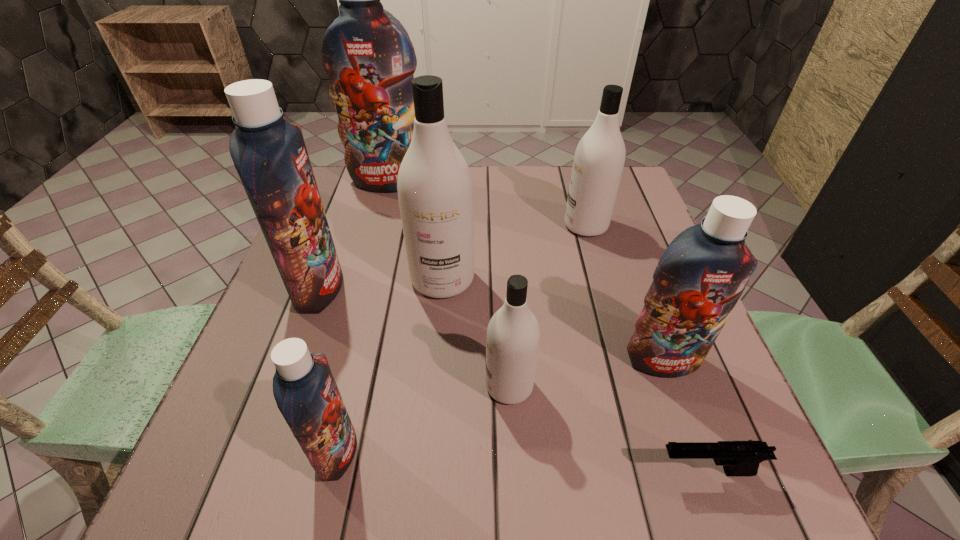
Locate an element on the screen. This screenshot has width=960, height=540. blue shampoo object that ranks as the closest to the leftmost white shampoo is located at coordinates (269, 154).

Identify which blue shampoo is located as the nearest to the pistol. Please provide its 2D coordinates. Your answer should be formatted as a tuple, i.e. [(x, y)], where the tuple contains the x and y coordinates of a point satisfying the conditions above.

[(700, 277)]

At what (x,y) coordinates should I click in order to perform the action: click on white shampoo that is the second closest one to the rightmost white shampoo. Please return your answer as a coordinate pair (x, y). The width and height of the screenshot is (960, 540). Looking at the image, I should click on (513, 334).

The height and width of the screenshot is (540, 960). I want to click on white shampoo that stands as the second closest to the third shampoo from right to left, so click(599, 158).

Identify the location of vacant space that satisfies the following two spatial constraints: 1. on the front label of the rightmost blue shampoo; 2. on the front label of the smallest blue shampoo. (696, 451).

The image size is (960, 540). Identify the location of blank area in the image that satisfies the following two spatial constraints: 1. on the front-facing side of the second nearest white shampoo; 2. on the front label of the nearest blue shampoo. (427, 451).

Where is `free space that satisfies the following two spatial constraints: 1. on the front label of the farthest object; 2. on the front label of the second farthest blue shampoo`? This screenshot has height=540, width=960. free space that satisfies the following two spatial constraints: 1. on the front label of the farthest object; 2. on the front label of the second farthest blue shampoo is located at coordinates (360, 288).

Locate an element on the screen. This screenshot has width=960, height=540. free point that satisfies the following two spatial constraints: 1. on the front-facing side of the leftmost white shampoo; 2. on the front label of the third nearest blue shampoo is located at coordinates (442, 288).